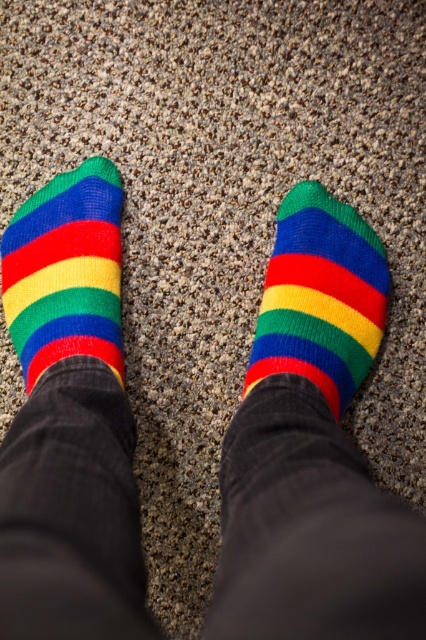
Question: Is knitted woolen sock at center below knitted wool socks at left?

Choices:
 (A) no
 (B) yes

Answer: (B)

Question: Observing the image, what is the correct spatial positioning of knitted woolen sock at center in reference to knitted wool socks at left?

Choices:
 (A) above
 (B) below

Answer: (B)

Question: Can you confirm if knitted woolen sock at center is wider than knitted wool socks at left?

Choices:
 (A) no
 (B) yes

Answer: (B)

Question: Which point appears closest to the camera in this image?

Choices:
 (A) (367, 356)
 (B) (43, 300)

Answer: (B)